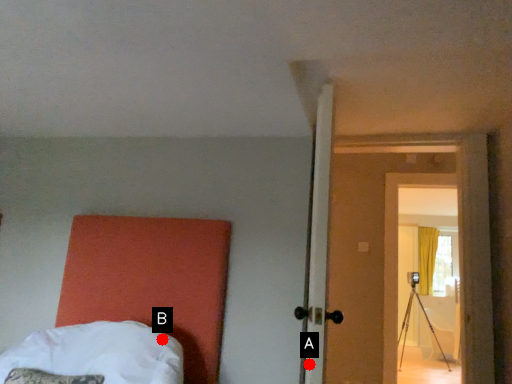
Question: Two points are circled on the image, labeled by A and B beside each circle. Which point appears closest to the camera in this image?

Choices:
 (A) A is closer
 (B) B is closer

Answer: (A)